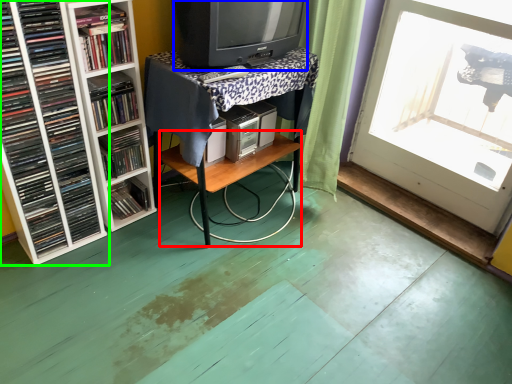
Question: Based on their relative distances, which object is farther from table (highlighted by a red box)? Choose from television (highlighted by a blue box) and book (highlighted by a green box).

Choices:
 (A) television
 (B) book

Answer: (B)